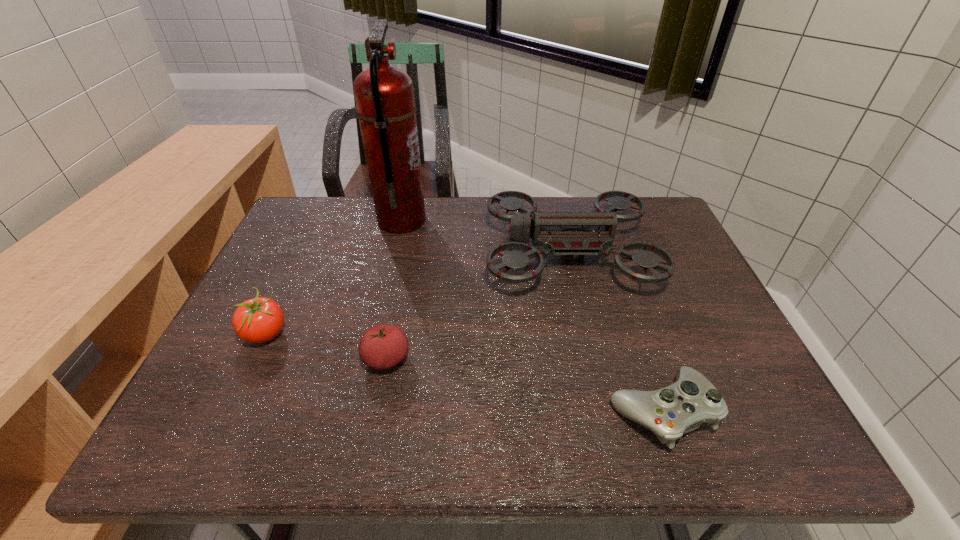
Identify the location of free space at the far edge of the desktop. (488, 227).

The image size is (960, 540). Find the location of `vacant space at the left edge of the desktop`. vacant space at the left edge of the desktop is located at coordinates (304, 288).

The width and height of the screenshot is (960, 540). Find the location of `vacant area at the near right corner`. vacant area at the near right corner is located at coordinates (752, 440).

At what (x,y) coordinates should I click in order to perform the action: click on vacant space that is in between the control and the right tomato. Please return your answer as a coordinate pair (x, y). Looking at the image, I should click on (524, 385).

The image size is (960, 540). Find the location of `vacant point located between the right tomato and the fire extinguisher`. vacant point located between the right tomato and the fire extinguisher is located at coordinates pos(394,290).

Image resolution: width=960 pixels, height=540 pixels. In order to click on empty space between the drone and the left tomato in this screenshot , I will do `click(417, 294)`.

Where is `free space between the leftmost object and the control`? The width and height of the screenshot is (960, 540). free space between the leftmost object and the control is located at coordinates (463, 373).

You are a GUI agent. You are given a task and a screenshot of the screen. Output one action in this format:
    pyautogui.click(x=<x>, y=<y>)
    Task: Click on the free spot between the shortest object and the right tomato
    
    Given the screenshot: What is the action you would take?
    pyautogui.click(x=524, y=385)

Locate an element on the screen. This screenshot has width=960, height=540. free space that is in between the control and the left tomato is located at coordinates (463, 373).

Where is `vacant point located between the right tomato and the shortest object`? This screenshot has height=540, width=960. vacant point located between the right tomato and the shortest object is located at coordinates (524, 385).